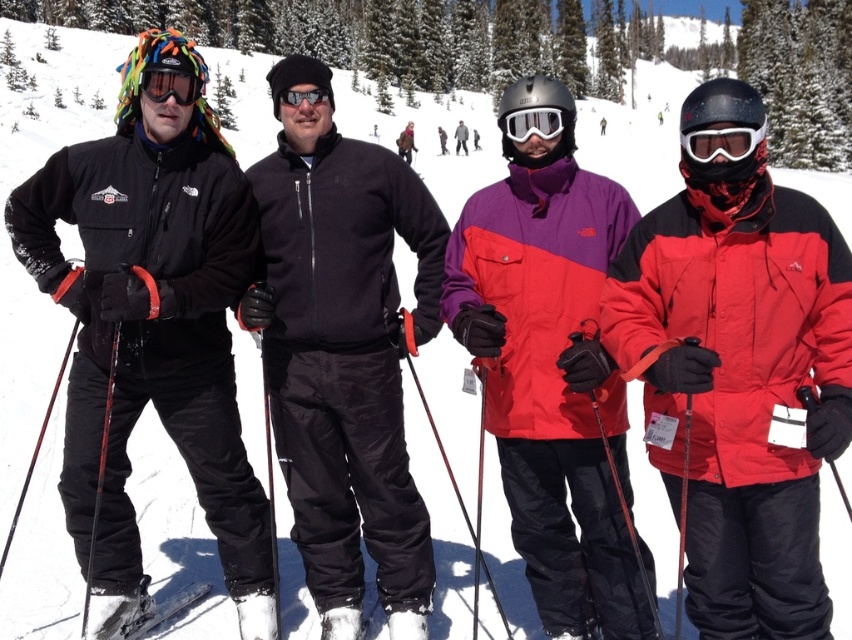
Who is higher up, matte black goggles at left or black matte goggles at center?

black matte goggles at center is above.

Is matte black goggles at left above black matte goggles at center?

Actually, matte black goggles at left is below black matte goggles at center.

Identify the location of matte black goggles at left. (170, 84).

Is point (118, 636) farther from viewer compared to point (145, 90)?

That is True.

Is white matte ski at lower left positioned before matte black goggles at left?

That is True.

Is point (95, 602) less distant than point (191, 88)?

Yes, point (95, 602) is closer to viewer.

Identify the location of white matte ski at lower left. (133, 611).

Is point (726, 128) positioned in front of point (182, 90)?

Yes, it is in front of point (182, 90).

Describe the element at coordinates (721, 141) in the screenshot. The height and width of the screenshot is (640, 852). I see `white matte ski goggles at center` at that location.

At what (x,y) coordinates should I click in order to perform the action: click on white matte ski goggles at center. Please return your answer as a coordinate pair (x, y). Image resolution: width=852 pixels, height=640 pixels. Looking at the image, I should click on (721, 141).